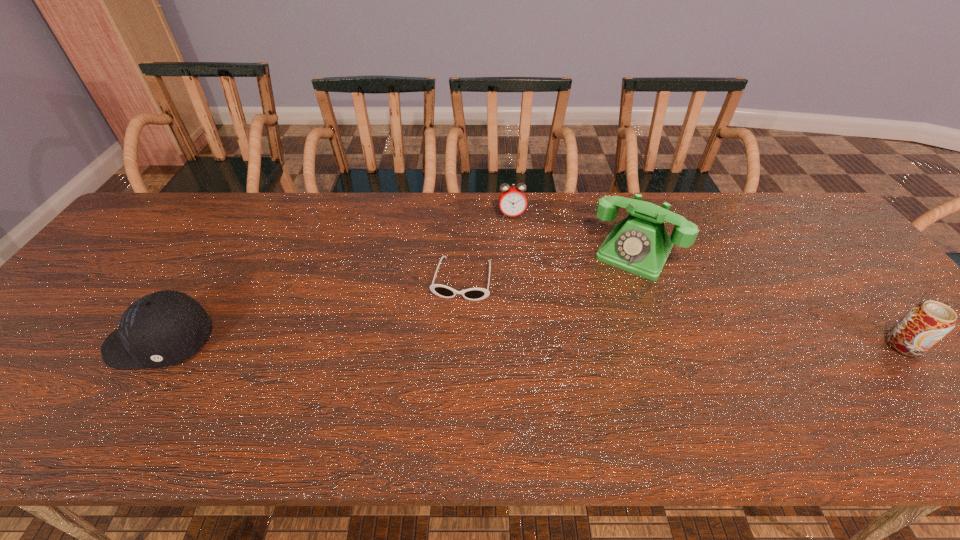
This screenshot has height=540, width=960. What are the coordinates of `vacant space located 0.090m at the front of the baseball cap where the brim is located` in the screenshot? It's located at (70, 343).

The height and width of the screenshot is (540, 960). Find the location of `vacant space situated on the left of the beer can`. vacant space situated on the left of the beer can is located at coordinates (810, 345).

Find the location of a particular element. The image size is (960, 540). vacant space located 0.120m with the lenses of the shortest object facing outward is located at coordinates (448, 339).

Find the location of a particular element. Image resolution: width=960 pixels, height=540 pixels. free space located 0.170m with the lenses of the shortest object facing outward is located at coordinates tap(445, 356).

Locate an element on the screen. The width and height of the screenshot is (960, 540). free space located with the lenses of the shortest object facing outward is located at coordinates pyautogui.click(x=443, y=367).

You are a GUI agent. You are given a task and a screenshot of the screen. Output one action in this format:
    pyautogui.click(x=<x>, y=<y>)
    Task: Click on the free spot located on the front-facing side of the alarm clock
    Image resolution: width=960 pixels, height=540 pixels.
    Given the screenshot: What is the action you would take?
    pyautogui.click(x=518, y=255)

The image size is (960, 540). Identify the location of free point located on the front-facing side of the alarm clock. (521, 275).

This screenshot has width=960, height=540. I want to click on vacant space located on the front-facing side of the alarm clock, so click(526, 306).

Locate an element on the screen. free space located on the dial of the telephone is located at coordinates (564, 376).

Find the location of `free space located 0.080m on the dial of the telephone`. free space located 0.080m on the dial of the telephone is located at coordinates pyautogui.click(x=611, y=295).